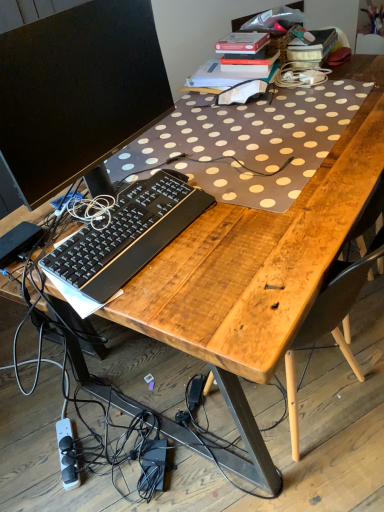
The width and height of the screenshot is (384, 512). What are the coordinates of `free area behind white plastic power strip at lower left` in the screenshot? It's located at (71, 409).